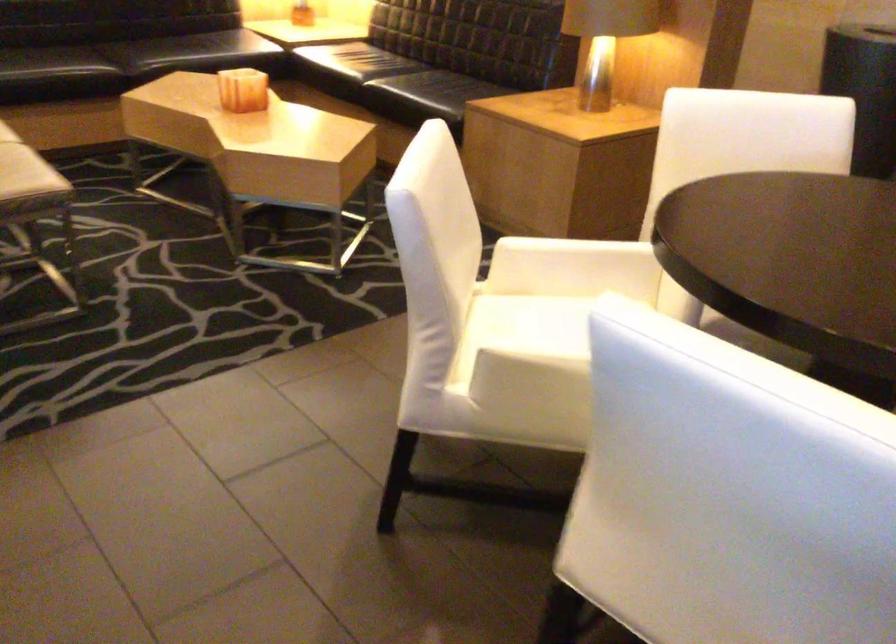
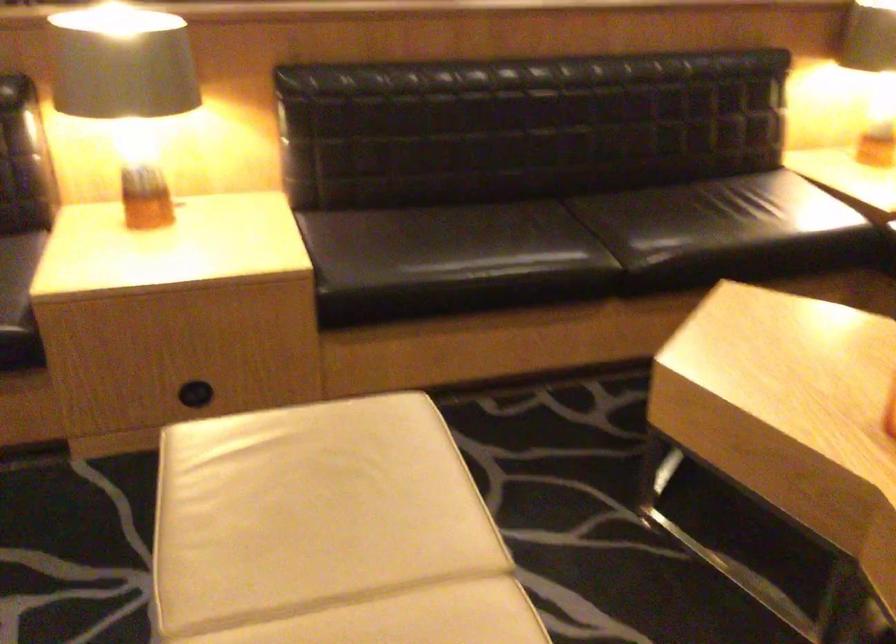
What movement of the cameraman would produce the second image?

The cameraman walked toward left, forward.